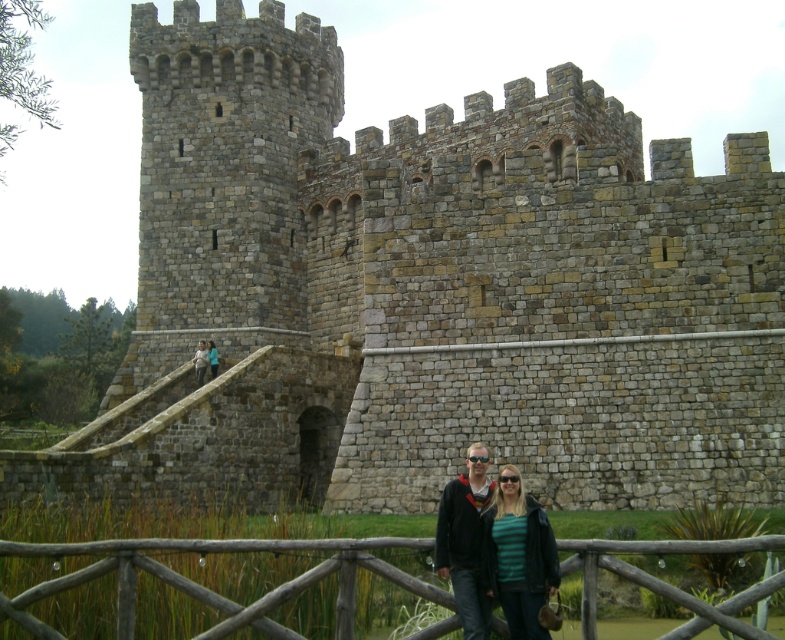
Between wooden fence at lower center and matte black jacket at lower center, which one is positioned higher?

Positioned higher is matte black jacket at lower center.

Between point (89, 566) and point (539, 556), which one is positioned behind?

The point (539, 556) is more distant.

At what (x,y) coordinates should I click in order to perform the action: click on wooden fence at lower center. Please return your answer as a coordinate pair (x, y). Looking at the image, I should click on (212, 589).

Does wooden fence at lower center have a greater height compared to light blue denim jacket at lower center?

Indeed, wooden fence at lower center has a greater height compared to light blue denim jacket at lower center.

The height and width of the screenshot is (640, 785). I want to click on wooden fence at lower center, so click(x=212, y=589).

Is matte black jacket at lower center in front of light blue denim jacket at lower center?

Yes.

You are a GUI agent. You are given a task and a screenshot of the screen. Output one action in this format:
    pyautogui.click(x=<x>, y=<y>)
    Task: Click on the matte black jacket at lower center
    The height and width of the screenshot is (640, 785).
    Given the screenshot: What is the action you would take?
    pyautogui.click(x=488, y=545)